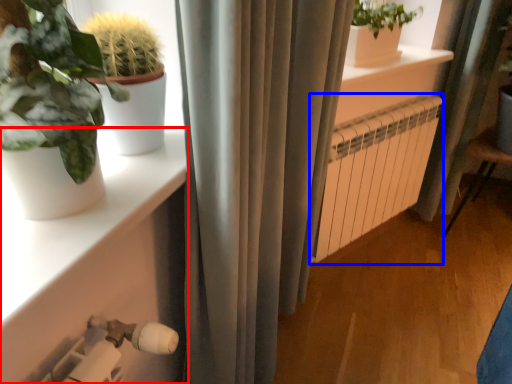
Question: Among these objects, which one is nearest to the camera, shelf (highlighted by a red box) or radiator (highlighted by a blue box)?

Choices:
 (A) shelf
 (B) radiator

Answer: (A)